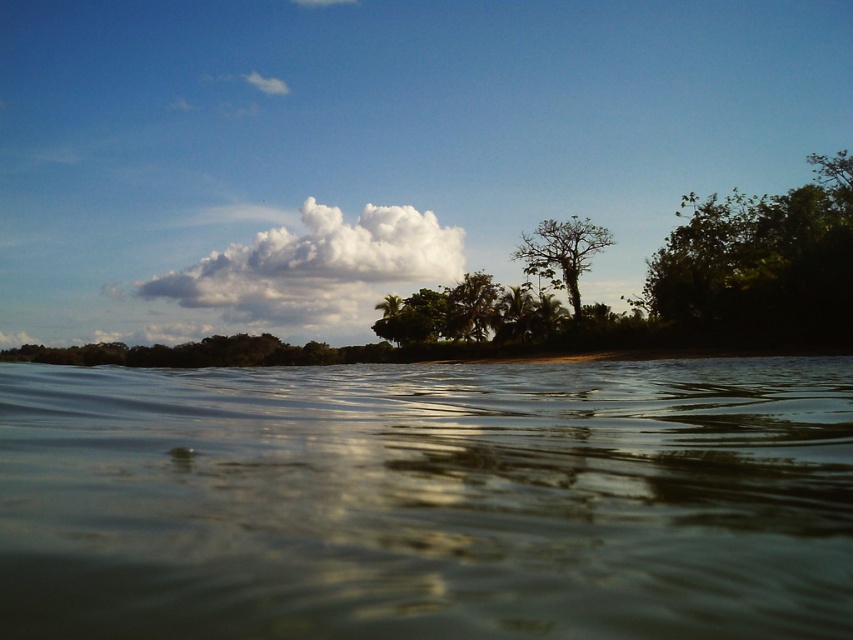
Question: Does green leafy tree at upper right lie behind green leafy tree at center?

Choices:
 (A) yes
 (B) no

Answer: (B)

Question: Does green leafy tree at upper right appear on the left side of white fluffy cloud at center?

Choices:
 (A) no
 (B) yes

Answer: (A)

Question: Estimate the real-world distances between objects in this image. Which object is closer to the white fluffy cloud at center?

Choices:
 (A) brown murky water at center
 (B) green leafy tree at center

Answer: (B)

Question: Does green leafy tree at upper right appear on the left side of white fluffy cloud at center?

Choices:
 (A) yes
 (B) no

Answer: (B)

Question: Among these points, which one is farthest from the camera?

Choices:
 (A) (578, 310)
 (B) (413, 436)
 (C) (675, 243)

Answer: (A)

Question: Among these points, which one is nearest to the camera?

Choices:
 (A) (741, 209)
 (B) (572, 218)
 (C) (326, 275)

Answer: (A)